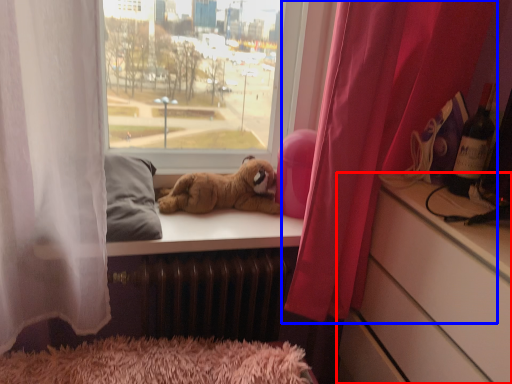
Question: Which point is closer to the camera, cabinetry (highlighted by a red box) or curtain (highlighted by a blue box)?

Choices:
 (A) cabinetry
 (B) curtain

Answer: (A)